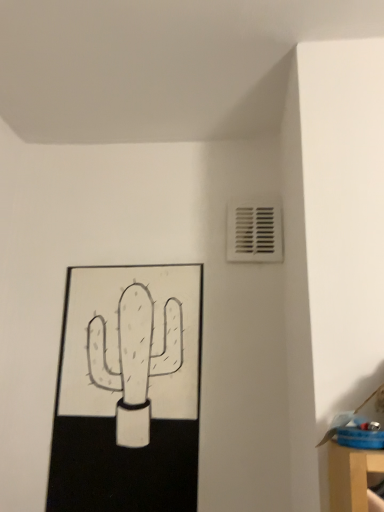
Question: Should I look upward or downward to see black matte picture frame at lower left?

Choices:
 (A) up
 (B) down

Answer: (B)

Question: Is white plastic vent at upper right surrounding black matte picture frame at lower left?

Choices:
 (A) yes
 (B) no

Answer: (B)

Question: Is white plastic vent at upper right wider than black matte picture frame at lower left?

Choices:
 (A) yes
 (B) no

Answer: (B)

Question: Is white plastic vent at upper right positioned behind black matte picture frame at lower left?

Choices:
 (A) yes
 (B) no

Answer: (A)

Question: Is white plastic vent at upper right outside of black matte picture frame at lower left?

Choices:
 (A) yes
 (B) no

Answer: (A)

Question: Considering the relative sizes of white plastic vent at upper right and black matte picture frame at lower left in the image provided, is white plastic vent at upper right shorter than black matte picture frame at lower left?

Choices:
 (A) yes
 (B) no

Answer: (A)

Question: From the image's perspective, does white plastic vent at upper right appear higher than black matte picture frame at lower left?

Choices:
 (A) yes
 (B) no

Answer: (A)

Question: Does black matte picture frame at lower left turn towards white plastic vent at upper right?

Choices:
 (A) no
 (B) yes

Answer: (A)

Question: Would you say black matte picture frame at lower left contains white plastic vent at upper right?

Choices:
 (A) no
 (B) yes

Answer: (A)

Question: Does black matte picture frame at lower left lie behind white plastic vent at upper right?

Choices:
 (A) yes
 (B) no

Answer: (B)

Question: Is black matte picture frame at lower left shorter than white plastic vent at upper right?

Choices:
 (A) no
 (B) yes

Answer: (A)

Question: Is black matte picture frame at lower left turned away from white plastic vent at upper right?

Choices:
 (A) no
 (B) yes

Answer: (A)

Question: Is the depth of black matte picture frame at lower left less than that of white plastic vent at upper right?

Choices:
 (A) yes
 (B) no

Answer: (A)

Question: In terms of width, does white plastic vent at upper right look wider or thinner when compared to black matte picture frame at lower left?

Choices:
 (A) thin
 (B) wide

Answer: (A)